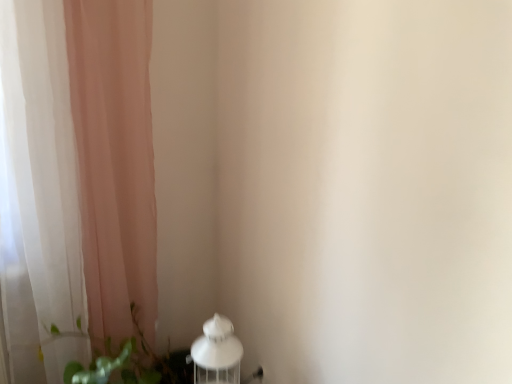
Question: Is white matte table lamp at lower left beside sheer pink curtain at left?

Choices:
 (A) no
 (B) yes

Answer: (A)

Question: From the image's perspective, is white matte table lamp at lower left over sheer pink curtain at left?

Choices:
 (A) no
 (B) yes

Answer: (A)

Question: Is white matte table lamp at lower left to the left of sheer pink curtain at left from the viewer's perspective?

Choices:
 (A) yes
 (B) no

Answer: (B)

Question: From a real-world perspective, is white matte table lamp at lower left positioned under sheer pink curtain at left based on gravity?

Choices:
 (A) yes
 (B) no

Answer: (A)

Question: From the image's perspective, does white matte table lamp at lower left appear lower than sheer pink curtain at left?

Choices:
 (A) no
 (B) yes

Answer: (B)

Question: Considering the relative sizes of white matte table lamp at lower left and sheer pink curtain at left in the image provided, is white matte table lamp at lower left wider than sheer pink curtain at left?

Choices:
 (A) no
 (B) yes

Answer: (A)

Question: Does sheer pink curtain at left lie in front of white matte table lamp at lower left?

Choices:
 (A) yes
 (B) no

Answer: (A)

Question: Is sheer pink curtain at left shorter than white matte table lamp at lower left?

Choices:
 (A) yes
 (B) no

Answer: (B)

Question: Could white matte table lamp at lower left be considered to be inside sheer pink curtain at left?

Choices:
 (A) no
 (B) yes

Answer: (A)

Question: Considering the relative sizes of sheer pink curtain at left and white matte table lamp at lower left in the image provided, is sheer pink curtain at left thinner than white matte table lamp at lower left?

Choices:
 (A) no
 (B) yes

Answer: (A)

Question: From a real-world perspective, is sheer pink curtain at left on top of white matte table lamp at lower left?

Choices:
 (A) yes
 (B) no

Answer: (A)

Question: Can you confirm if sheer pink curtain at left is positioned to the left of white matte table lamp at lower left?

Choices:
 (A) yes
 (B) no

Answer: (A)

Question: From a real-world perspective, is white matte table lamp at lower left positioned over green leafy plant at lower left based on gravity?

Choices:
 (A) yes
 (B) no

Answer: (A)